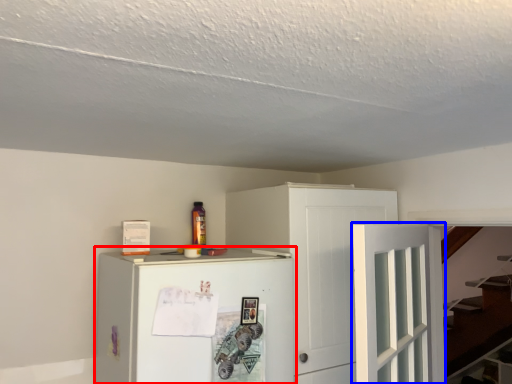
Question: Which object is further to the camera taking this photo, refrigerator (highlighted by a red box) or door (highlighted by a blue box)?

Choices:
 (A) refrigerator
 (B) door

Answer: (A)